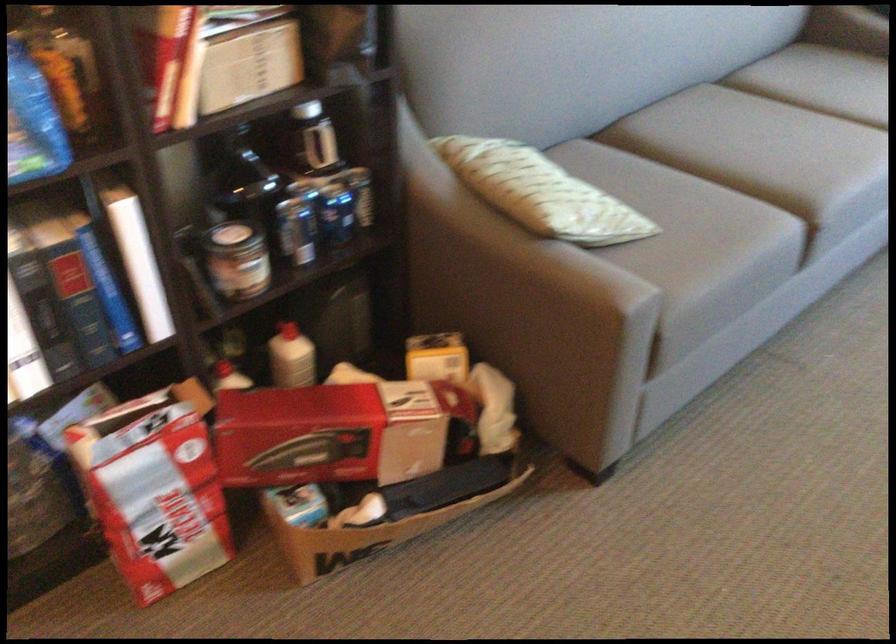
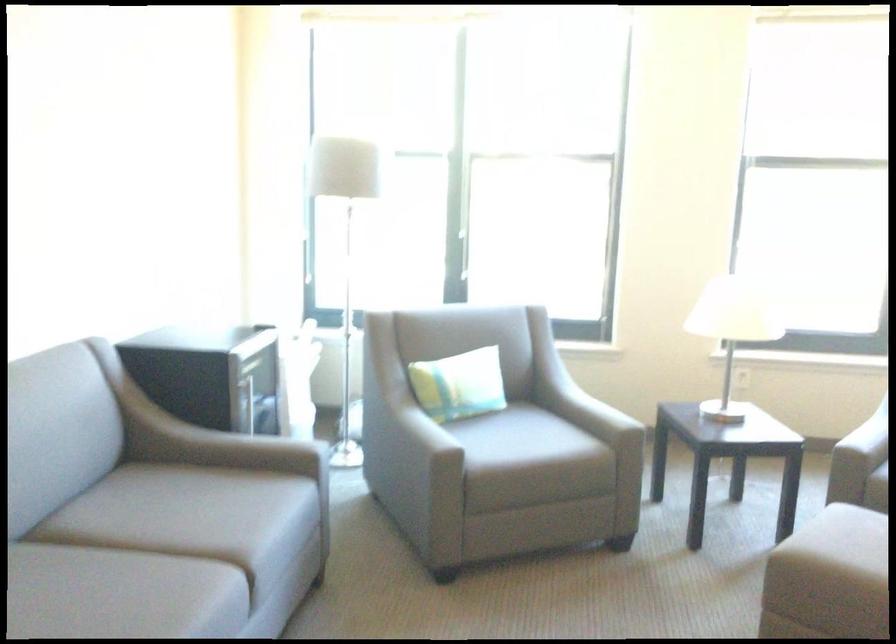
Find the pixel in the second image that matches (814,128) in the first image.

(119, 594)